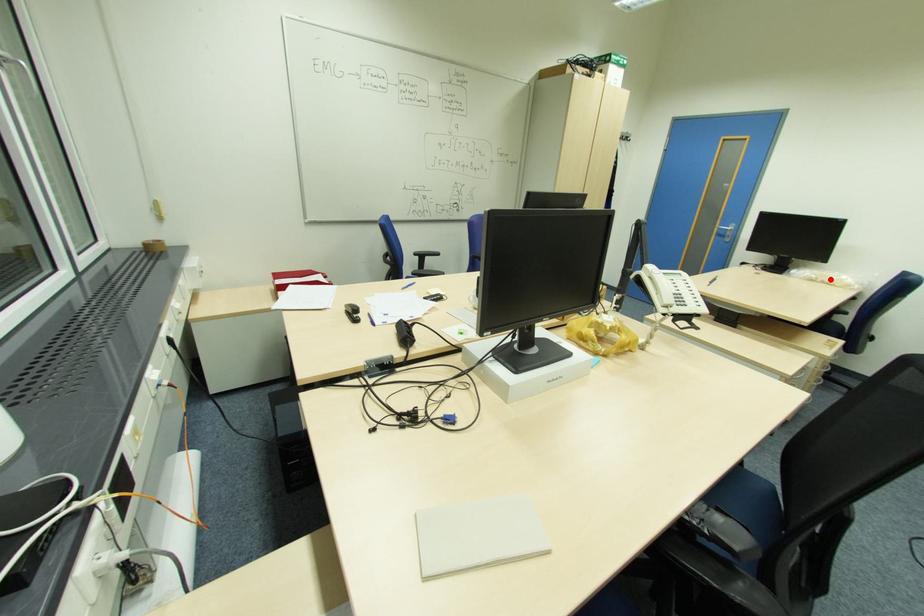
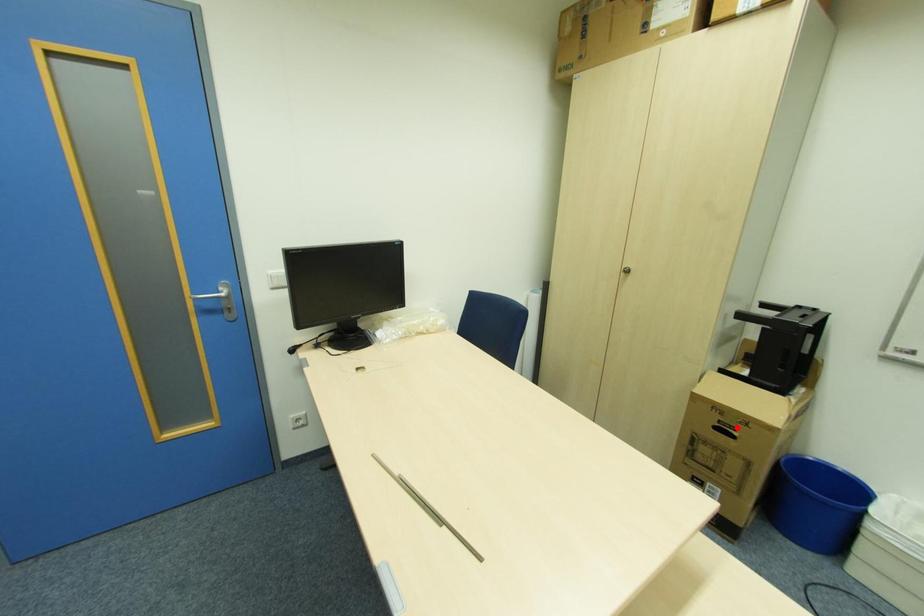
I am providing you with two images of the same scene from different viewpoints. A red point is marked on the first image and another point is marked on the second image. Do the highlighted points in image1 and image2 indicate the same real-world spot?

No